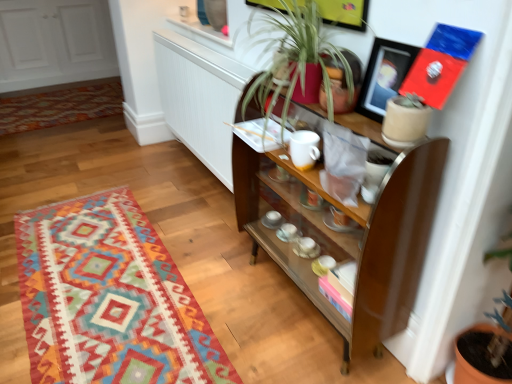
At what (x,y) coordinates should I click in order to perform the action: click on vacant region to the left of brown wooden shelf at center. Please return your answer as a coordinate pair (x, y). The width and height of the screenshot is (512, 384). Looking at the image, I should click on (226, 285).